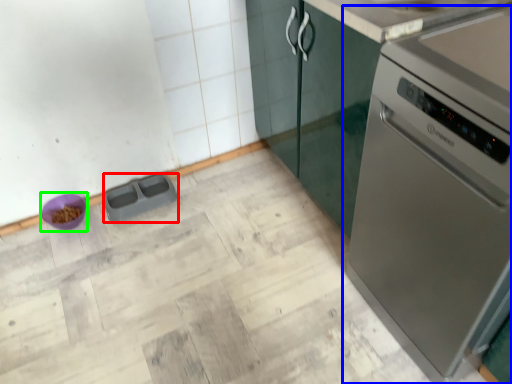
Question: Which is nearer to the appliance (highlighted by a red box)? home appliance (highlighted by a blue box) or appliance (highlighted by a green box).

Choices:
 (A) home appliance
 (B) appliance

Answer: (B)